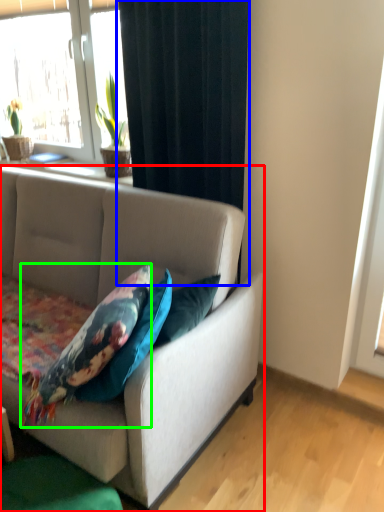
Question: Which object is positioned farthest from studio couch (highlighted by a red box)? Select from curtain (highlighted by a blue box) and pillow (highlighted by a green box).

Choices:
 (A) curtain
 (B) pillow

Answer: (A)